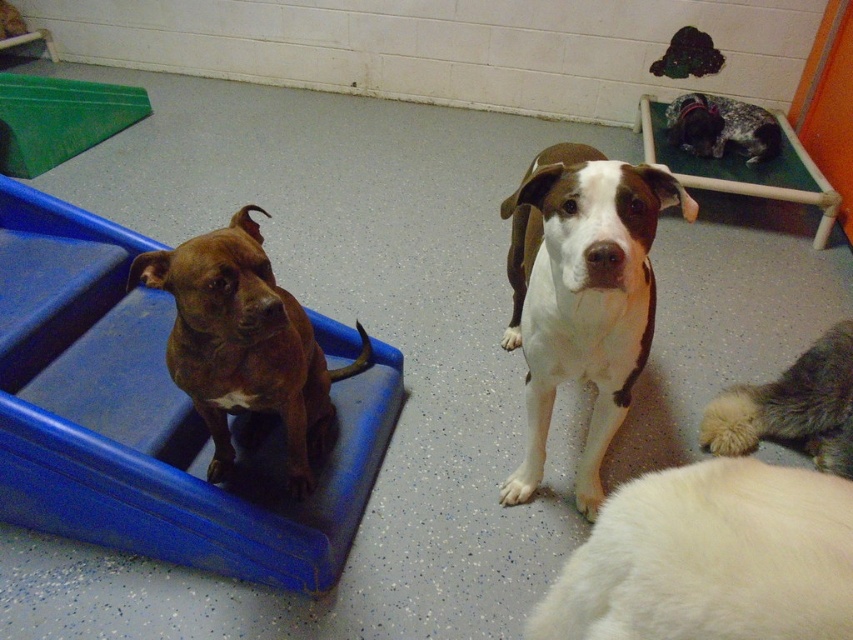
Which is more to the left, brown glossy dog at left or fluffy white cat at lower right?

From the viewer's perspective, brown glossy dog at left appears more on the left side.

Is brown glossy dog at left further to camera compared to fluffy white cat at lower right?

That is False.

Between point (213, 250) and point (763, 413), which one is positioned behind?

Positioned behind is point (763, 413).

You are a GUI agent. You are given a task and a screenshot of the screen. Output one action in this format:
    pyautogui.click(x=<x>, y=<y>)
    Task: Click on the brown glossy dog at left
    The height and width of the screenshot is (640, 853).
    Given the screenshot: What is the action you would take?
    pyautogui.click(x=244, y=342)

Is point (581, 173) behind point (750, 403)?

No, it is in front of (750, 403).

Is point (585, 317) farther from viewer compared to point (743, 394)?

No, (585, 317) is closer to viewer.

At what (x,y) coordinates should I click in order to perform the action: click on white smooth dog at center. Please return your answer as a coordinate pair (x, y). This screenshot has height=640, width=853. Looking at the image, I should click on (582, 294).

Between fluffy white cat at lower right and spotted fur bed at upper right, which one appears on the left side from the viewer's perspective?

Positioned to the left is fluffy white cat at lower right.

Is point (808, 424) less distant than point (764, 134)?

Yes, point (808, 424) is in front of point (764, 134).

Is point (839, 424) less distant than point (735, 100)?

Yes, it is.

This screenshot has height=640, width=853. What are the coordinates of `fluffy white cat at lower right` in the screenshot? It's located at (792, 406).